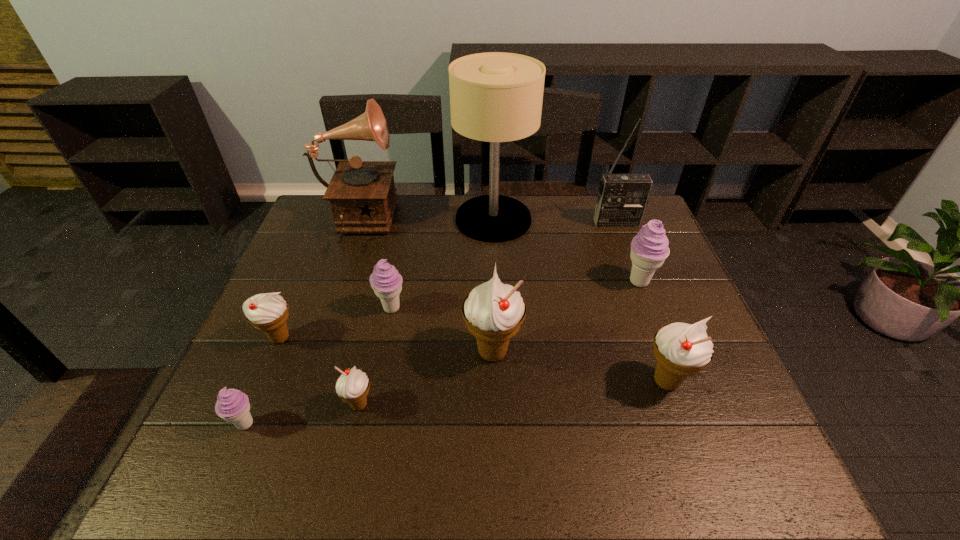
Locate an element on the screen. empty space that is in between the tallest object and the radio receiver is located at coordinates (555, 221).

At what (x,y) coordinates should I click in order to perform the action: click on free spot between the seventh shortest object and the third smallest white icecream. Please return your answer as a coordinate pair (x, y). Looking at the image, I should click on (579, 367).

Where is `free spot between the sixth nearest icecream and the rightmost white icecream`? free spot between the sixth nearest icecream and the rightmost white icecream is located at coordinates (529, 345).

Where is `free point between the second farthest icecream and the radio receiver`? The height and width of the screenshot is (540, 960). free point between the second farthest icecream and the radio receiver is located at coordinates (504, 266).

Identify the location of vacant space that's between the second white icecream from left to right and the rightmost white icecream. This screenshot has height=540, width=960. (513, 393).

Locate which object is the ninth closest to the farthest icecream. Please provide its 2D coordinates. Your answer should be formatted as a tuple, i.e. [(x, y)], where the tuple contains the x and y coordinates of a point satisfying the conditions above.

[(232, 405)]

Identify the location of the fifth closest object to the third smallest white icecream. Image resolution: width=960 pixels, height=540 pixels. (385, 280).

Where is `icecream that is the sixth closest to the leftmost purple icecream`? Image resolution: width=960 pixels, height=540 pixels. icecream that is the sixth closest to the leftmost purple icecream is located at coordinates (649, 248).

Identify which icecream is the closest to the record player. Please provide its 2D coordinates. Your answer should be formatted as a tuple, i.e. [(x, y)], where the tuple contains the x and y coordinates of a point satisfying the conditions above.

[(385, 280)]

Locate which white icecream is the closest to the leftmost purple icecream. Please provide its 2D coordinates. Your answer should be formatted as a tuple, i.e. [(x, y)], where the tuple contains the x and y coordinates of a point satisfying the conditions above.

[(268, 312)]